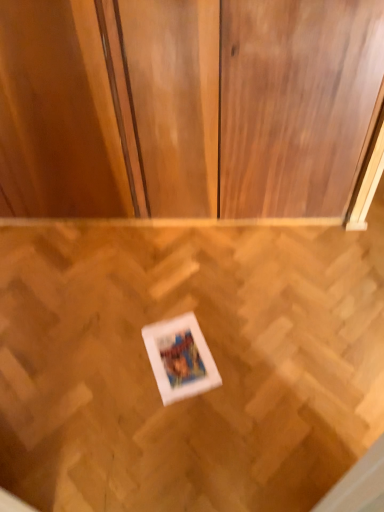
Identify the location of vacant area that is in front of white matte picture frame at center. The image size is (384, 512). (178, 419).